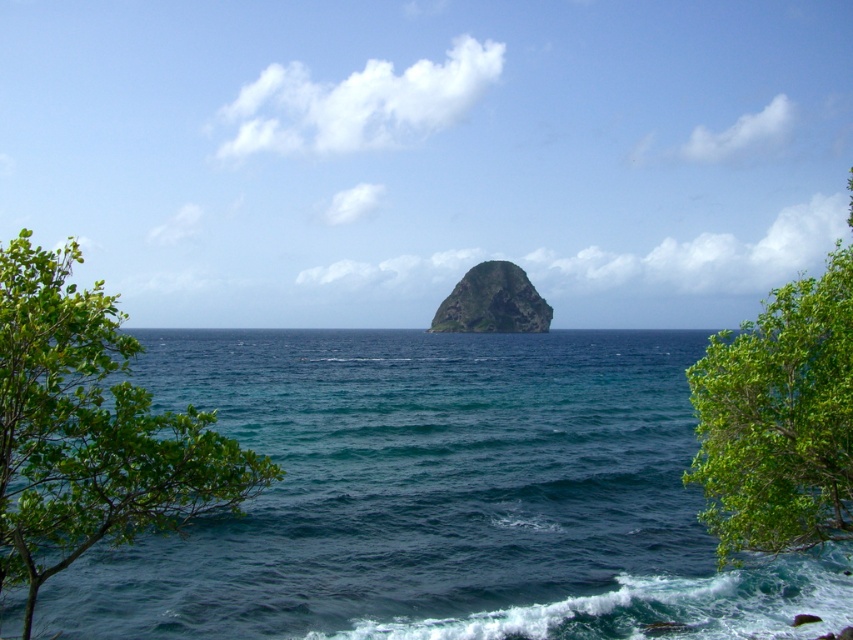
Question: Estimate the real-world distances between objects in this image. Which object is closer to the green rough rock at center?

Choices:
 (A) green leafy tree at lower right
 (B) deep blue water at center

Answer: (B)

Question: Which object appears closest to the camera in this image?

Choices:
 (A) green leafy tree at left
 (B) deep blue water at center
 (C) green rough rock at center

Answer: (A)

Question: Which is nearer to the green rough rock at center?

Choices:
 (A) deep blue water at center
 (B) green leafy tree at lower right
 (C) green leafy tree at left

Answer: (A)

Question: Is deep blue water at center positioned in front of green rough rock at center?

Choices:
 (A) yes
 (B) no

Answer: (A)

Question: Does green leafy tree at left have a larger size compared to green leafy tree at lower right?

Choices:
 (A) no
 (B) yes

Answer: (B)

Question: Does green leafy tree at lower right appear on the left side of green rough rock at center?

Choices:
 (A) no
 (B) yes

Answer: (B)